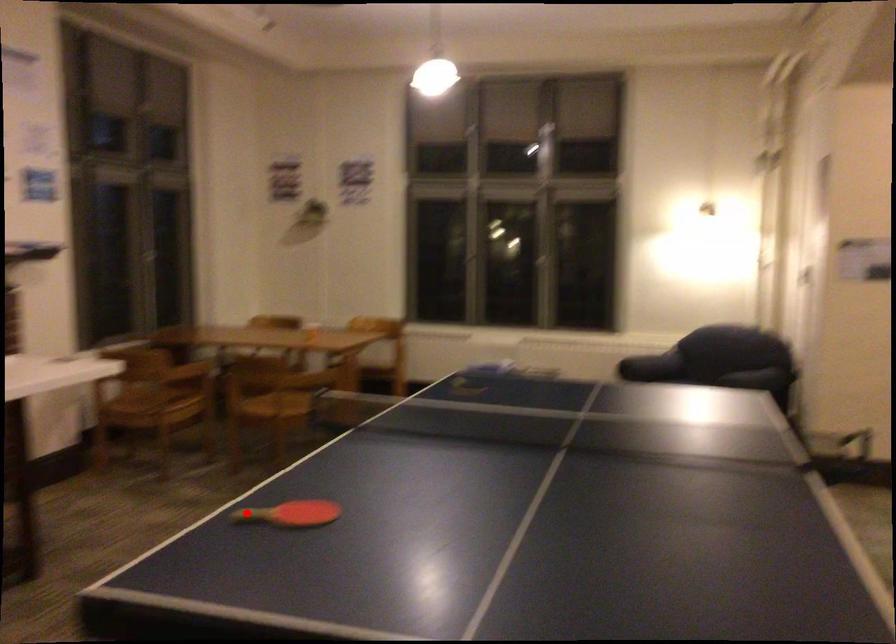
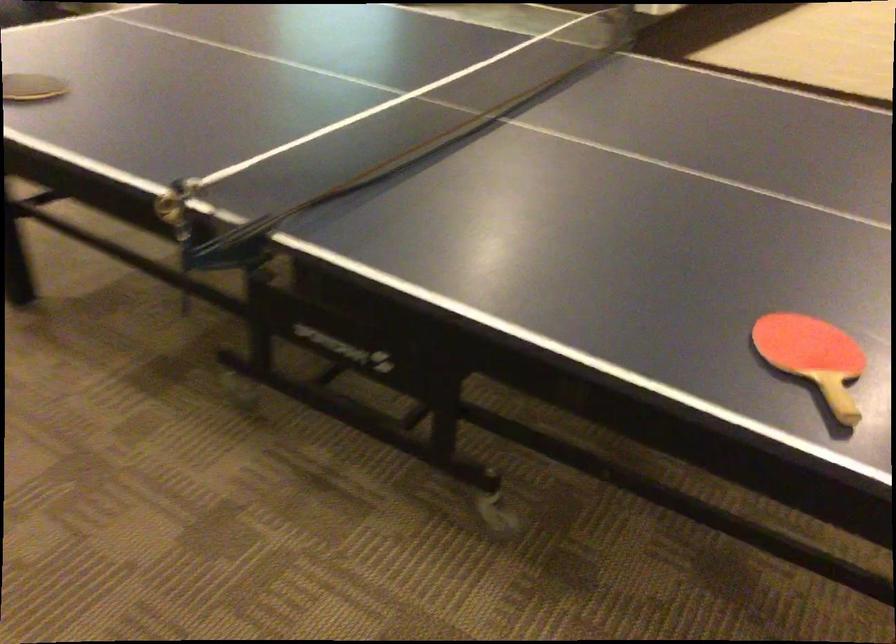
Question: I am providing you with two images of the same scene from different viewpoints. A red point is shown in image1. For the corresponding object point in image2, is it positioned nearer or farther from the camera?

Choices:
 (A) Nearer
 (B) Farther

Answer: (A)